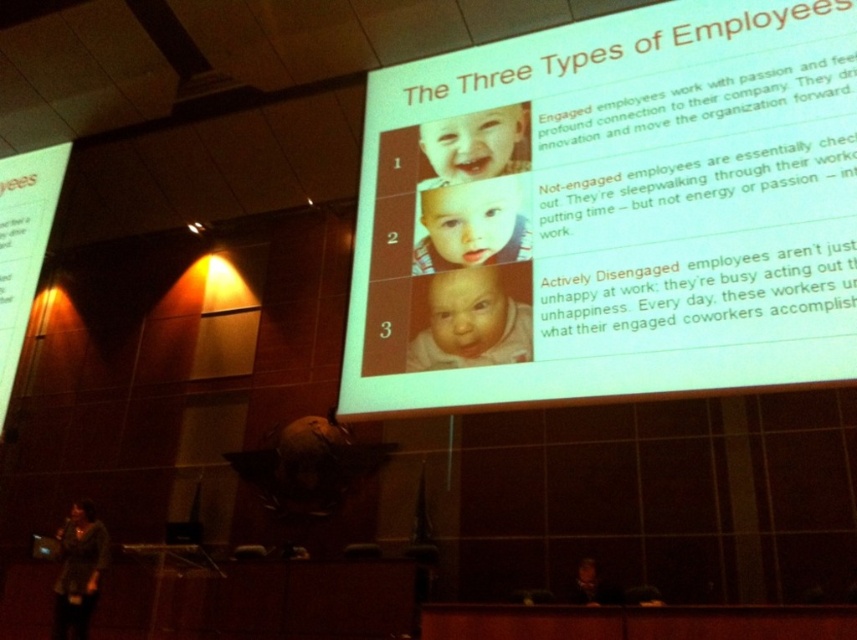
What are the coordinates of the white paper at upper center?

The white paper at upper center is located at coordinates point [609,212].

Based on the scene description, what can you infer about the size relationship between the white paper at upper center and the smooth white baby at center?

The white paper at upper center is larger in size compared to the smooth white baby at center.

You are an attendee in the conference room and want to hand a document to the presenter. You see the white paper at upper center and the smooth white baby at center. Which object is closer to you?

The white paper at upper center is closer to you because it is in front of the smooth white baby at center.